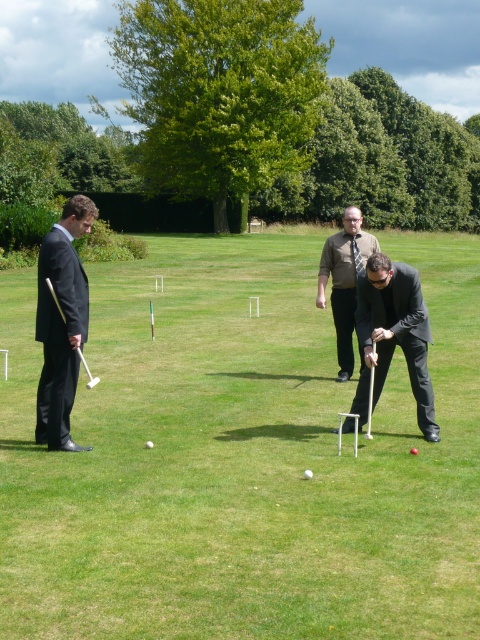
You are a photographer trying to capture a clear shot of the green grass at center and the black glossy suit at center. Based on their heights, which one will appear larger in the photo?

The green grass at center is taller than the black glossy suit at center, so the green grass at center will appear larger in the photo.

You are standing at the center of the field and see the point marked at coordinates (396, 330). What object is located at that point?

The point at coordinates (396, 330) corresponds to the black glossy suit at center.

You are a photographer trying to capture a clear shot of the black glossy suit at center without the green grass at center blocking it. What adjustment should you make to your camera angle?

The green grass at center is positioned over the black glossy suit at center, so you should lower your camera angle to avoid the grass blocking the suit.